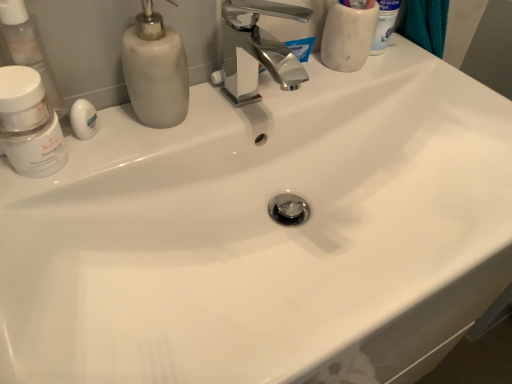
Identify the location of vacant space to the right of white marble cup at upper right, acting as the 2th toiletry starting from the left. (419, 72).